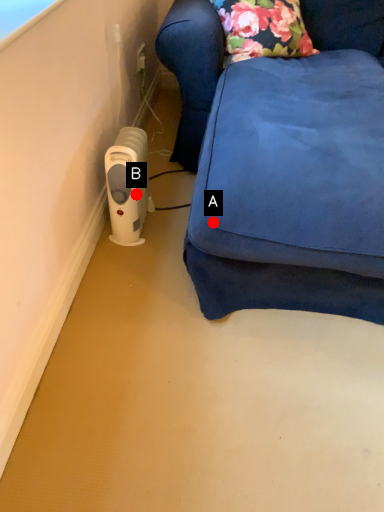
Question: Two points are circled on the image, labeled by A and B beside each circle. Which point is farther from the camera taking this photo?

Choices:
 (A) A is further
 (B) B is further

Answer: (B)